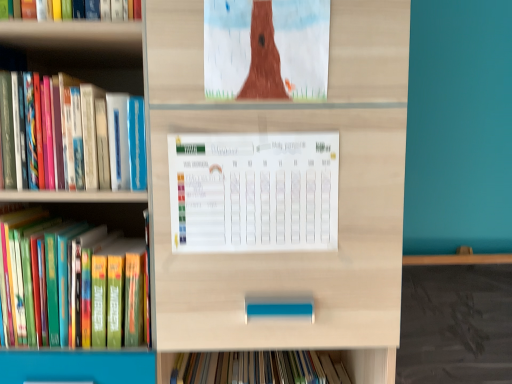
Question: Can you confirm if matte brown tree at upper center is thinner than hardcover book at left, the 1th book viewed from the top?

Choices:
 (A) no
 (B) yes

Answer: (B)

Question: Can you confirm if matte brown tree at upper center is bigger than hardcover book at left, the 1th book viewed from the top?

Choices:
 (A) no
 (B) yes

Answer: (A)

Question: Is matte brown tree at upper center far away from hardcover book at left, the 1th book viewed from the top?

Choices:
 (A) no
 (B) yes

Answer: (A)

Question: Does matte brown tree at upper center lie in front of hardcover book at left, the 1th book viewed from the top?

Choices:
 (A) yes
 (B) no

Answer: (A)

Question: Is matte brown tree at upper center to the left of hardcover book at left, the 1th book viewed from the top, from the viewer's perspective?

Choices:
 (A) no
 (B) yes

Answer: (A)

Question: From the image's perspective, is matte brown tree at upper center under hardcover book at left, the 1th book viewed from the top?

Choices:
 (A) no
 (B) yes

Answer: (A)

Question: From a real-world perspective, is hardcover book at left, the 1th book viewed from the top, over hardcover book at left, marked as the 1th book in a bottom-to-top arrangement?

Choices:
 (A) yes
 (B) no

Answer: (A)

Question: Can you confirm if hardcover book at left, placed as the second book when sorted from bottom to top, is shorter than hardcover book at left, marked as the 1th book in a bottom-to-top arrangement?

Choices:
 (A) yes
 (B) no

Answer: (B)

Question: Is hardcover book at left, the 1th book viewed from the top, closer to camera compared to hardcover book at left, which appears as the second book when viewed from the top?

Choices:
 (A) yes
 (B) no

Answer: (A)

Question: Is hardcover book at left, placed as the second book when sorted from bottom to top, not near hardcover book at left, marked as the 1th book in a bottom-to-top arrangement?

Choices:
 (A) yes
 (B) no

Answer: (B)

Question: From the image's perspective, is hardcover book at left, placed as the second book when sorted from bottom to top, above hardcover book at left, marked as the 1th book in a bottom-to-top arrangement?

Choices:
 (A) yes
 (B) no

Answer: (A)

Question: From a real-world perspective, does hardcover book at left, the 1th book viewed from the top, sit lower than hardcover book at left, which appears as the second book when viewed from the top?

Choices:
 (A) yes
 (B) no

Answer: (B)

Question: Is matte brown tree at upper center oriented away from white paper calendar at center?

Choices:
 (A) yes
 (B) no

Answer: (B)